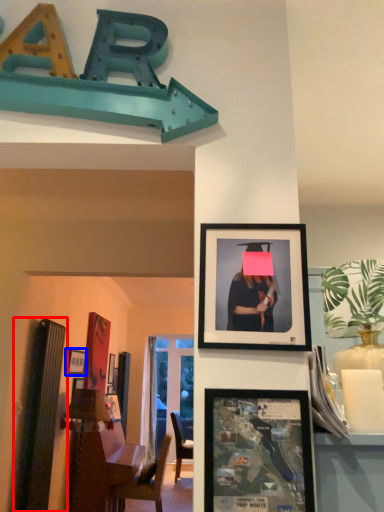
Question: Which point is further to the camera, bulletin board (highlighted by a red box) or picture frame (highlighted by a blue box)?

Choices:
 (A) bulletin board
 (B) picture frame

Answer: (B)